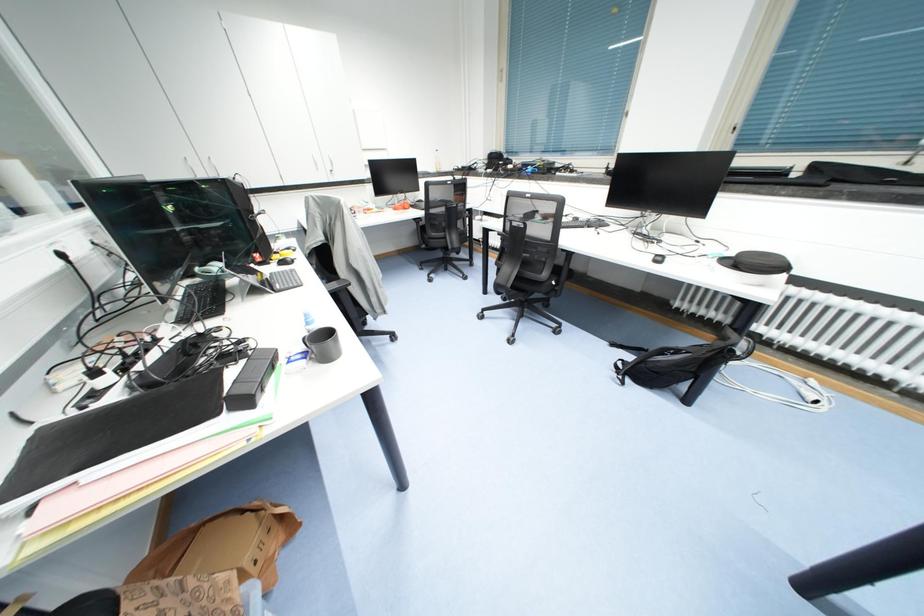
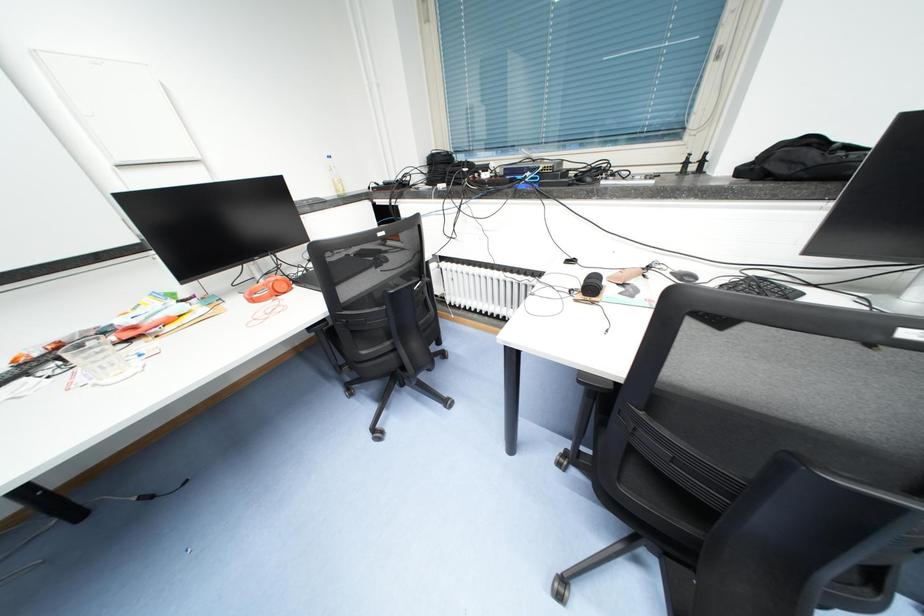
Question: What movement of the cameraman would produce the second image?

Choices:
 (A) Left
 (B) Right
 (C) Forward
 (D) Backward

Answer: (C)